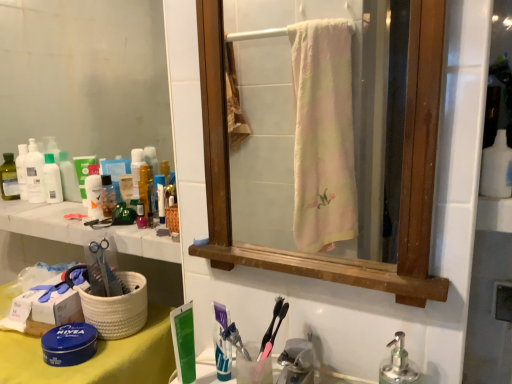
Question: Could you tell me if translucent plastic bottles at left, which ranks as the second toiletry in right-to-left order, is facing white marble counter at upper left?

Choices:
 (A) yes
 (B) no

Answer: (B)

Question: Is the surface of translucent plastic bottles at left, which ranks as the second toiletry in right-to-left order, in direct contact with white marble counter at upper left?

Choices:
 (A) yes
 (B) no

Answer: (B)

Question: Is white marble counter at upper left a part of translucent plastic bottles at left, the first toiletry positioned from the left?

Choices:
 (A) yes
 (B) no

Answer: (B)

Question: Is translucent plastic bottles at left, the first toiletry positioned from the left, positioned beyond the bounds of white marble counter at upper left?

Choices:
 (A) yes
 (B) no

Answer: (A)

Question: Does translucent plastic bottles at left, the first toiletry positioned from the left, appear on the right side of white marble counter at upper left?

Choices:
 (A) yes
 (B) no

Answer: (B)

Question: Does translucent plastic bottles at left, the first toiletry positioned from the left, have a lesser width compared to white marble counter at upper left?

Choices:
 (A) yes
 (B) no

Answer: (A)

Question: Is white marble counter at upper left in front of translucent plastic mouthwash at left, which ranks as the second mouthwash in front-to-back order?

Choices:
 (A) yes
 (B) no

Answer: (A)

Question: Is translucent plastic mouthwash at left, which ranks as the second mouthwash in front-to-back order, inside white marble counter at upper left?

Choices:
 (A) no
 (B) yes

Answer: (A)

Question: Are white marble counter at upper left and translucent plastic mouthwash at left, the second mouthwash from the right, beside each other?

Choices:
 (A) no
 (B) yes

Answer: (A)

Question: From a real-world perspective, is white marble counter at upper left positioned over translucent plastic mouthwash at left, which ranks as the second mouthwash in front-to-back order, based on gravity?

Choices:
 (A) yes
 (B) no

Answer: (B)

Question: Is white marble counter at upper left taller than translucent plastic mouthwash at left, which is counted as the 1th mouthwash, starting from the back?

Choices:
 (A) no
 (B) yes

Answer: (A)

Question: Would you say white marble counter at upper left is a long distance from translucent plastic mouthwash at left, which is counted as the 1th mouthwash, starting from the back?

Choices:
 (A) yes
 (B) no

Answer: (B)

Question: Does white marble counter at upper left have a greater height compared to white matte bottle at upper right?

Choices:
 (A) no
 (B) yes

Answer: (A)